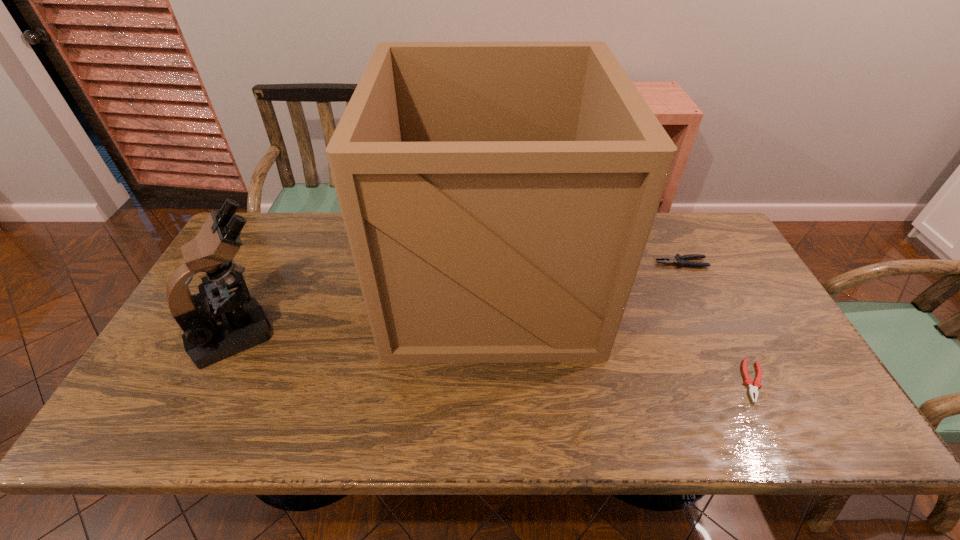
Where is `vacant space located at the gripping part of the farther pliers`? This screenshot has width=960, height=540. vacant space located at the gripping part of the farther pliers is located at coordinates (630, 263).

Identify the location of vacant space located 0.380m at the gripping part of the farther pliers. The width and height of the screenshot is (960, 540). (532, 263).

Find the location of a particular element. This screenshot has width=960, height=540. free space located 0.070m at the gripping part of the farther pliers is located at coordinates [633, 263].

At what (x,y) coordinates should I click in order to perform the action: click on vacant region located 0.050m on the left of the shorter pliers. Please return your answer as a coordinate pair (x, y). The height and width of the screenshot is (540, 960). Looking at the image, I should click on (720, 381).

This screenshot has width=960, height=540. Find the location of `box that is at the far edge`. box that is at the far edge is located at coordinates (498, 197).

Where is `pliers located in the far edge section of the desktop`? pliers located in the far edge section of the desktop is located at coordinates (679, 260).

This screenshot has width=960, height=540. Identify the location of object that is at the near edge. (753, 387).

Locate an element on the screen. The width and height of the screenshot is (960, 540). object present at the left edge is located at coordinates (214, 327).

Identify the location of object situated at the far right corner. This screenshot has width=960, height=540. (679, 260).

Identify the location of object at the near right corner. The height and width of the screenshot is (540, 960). click(x=753, y=387).